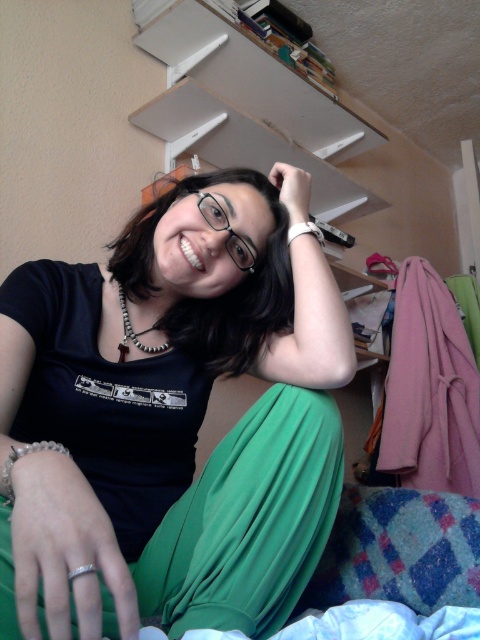
Question: Does matte black shirt at center come in front of white matte bookshelf at upper center?

Choices:
 (A) yes
 (B) no

Answer: (A)

Question: Does white matte bookshelf at upper center have a smaller size compared to silver beaded bracelet at wrist?

Choices:
 (A) no
 (B) yes

Answer: (A)

Question: Among these points, which one is farthest from the camera?

Choices:
 (A) (10, 499)
 (B) (122, 304)
 (C) (304, 232)
 (D) (272, 54)

Answer: (D)

Question: Does white matte bookshelf at upper center have a larger size compared to white beaded necklace at center?

Choices:
 (A) yes
 (B) no

Answer: (A)

Question: Which object is farther from the camera taking this photo?

Choices:
 (A) white leather bracelet at upper center
 (B) matte black shirt at center

Answer: (A)

Question: Among these objects, which one is nearest to the camera?

Choices:
 (A) white leather bracelet at upper center
 (B) white beaded necklace at center

Answer: (B)